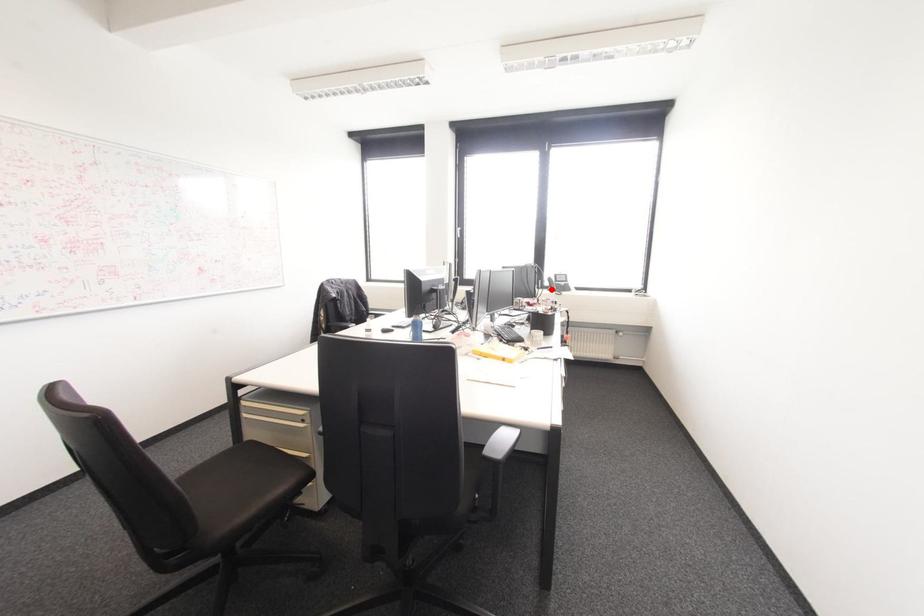
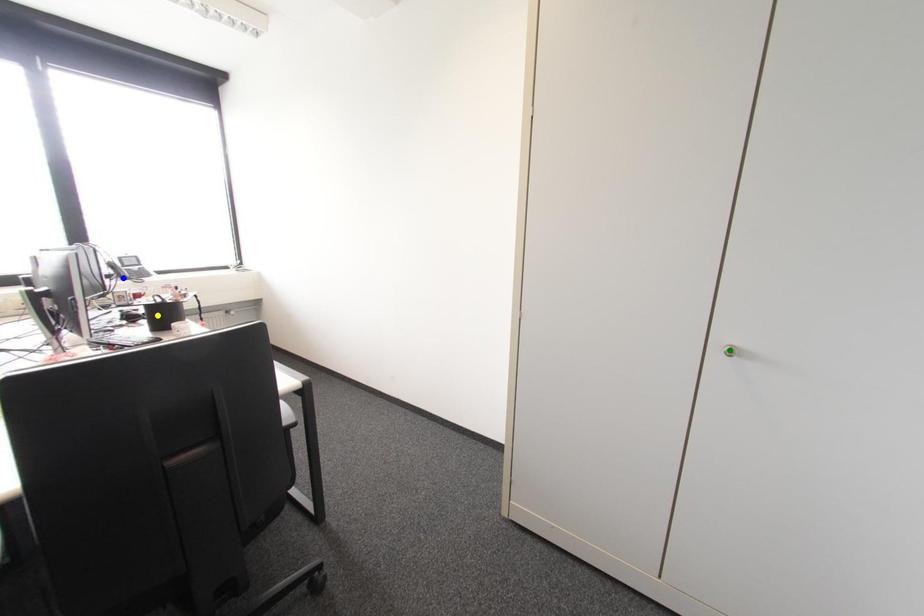
Question: I am providing you with two images of the same scene from different viewpoints. A red point is marked on the first image. You are given multiple points on the second image. Which spot in image 2 lines up with the point in image 1?

Choices:
 (A) yellow point
 (B) green point
 (C) blue point

Answer: (C)